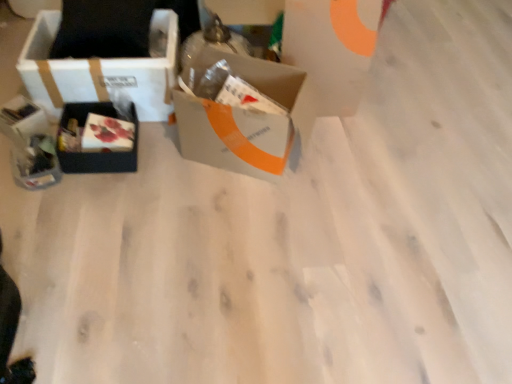
This screenshot has height=384, width=512. Find the location of `spots to the right of matte black gift box at left, which ranks as the first gift box in bottom-to-top order`. spots to the right of matte black gift box at left, which ranks as the first gift box in bottom-to-top order is located at coordinates (84, 188).